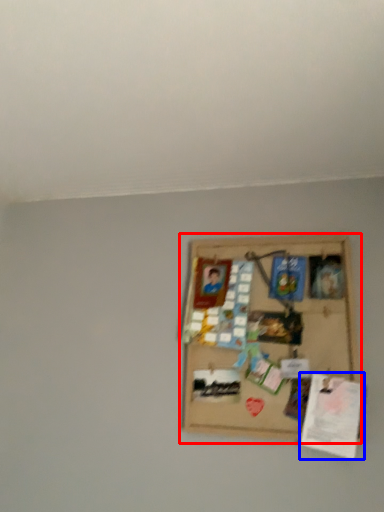
Question: Which object is closer to the camera taking this photo, picture frame (highlighted by a red box) or plaque (highlighted by a blue box)?

Choices:
 (A) picture frame
 (B) plaque

Answer: (B)